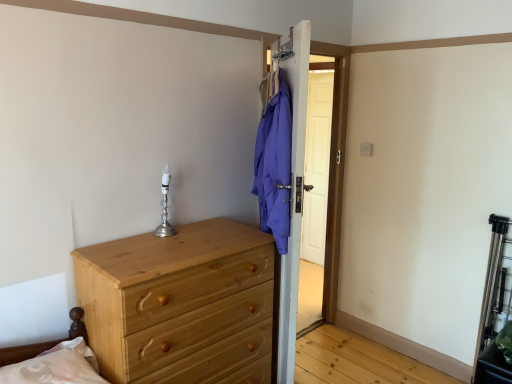
Measure the distance between natural wood chest of drawers at lower left and camera.

natural wood chest of drawers at lower left and camera are 4.91 feet apart.

Where is `silver metallic candle holder at center`? Image resolution: width=512 pixels, height=384 pixels. silver metallic candle holder at center is located at coordinates (165, 208).

Is the depth of silver metallic candle holder at center greater than that of natural wood chest of drawers at lower left?

Yes, the depth of silver metallic candle holder at center is greater than that of natural wood chest of drawers at lower left.

Based on the photo, is silver metallic candle holder at center inside the boundaries of natural wood chest of drawers at lower left, or outside?

silver metallic candle holder at center is not enclosed by natural wood chest of drawers at lower left.

Could you measure the distance between silver metallic candle holder at center and natural wood chest of drawers at lower left?

A distance of 18.42 inches exists between silver metallic candle holder at center and natural wood chest of drawers at lower left.

From a real-world perspective, is silver metallic candle holder at center over natural wood chest of drawers at lower left?

Yes, from a real-world perspective, silver metallic candle holder at center is over natural wood chest of drawers at lower left

Is point (183, 353) closer to viewer compared to point (91, 358)?

No, (183, 353) is behind (91, 358).

Can we say natural wood chest of drawers at lower left lies outside brown wooden bed frame at lower left?

Indeed, natural wood chest of drawers at lower left is completely outside brown wooden bed frame at lower left.

Relative to brown wooden bed frame at lower left, is natural wood chest of drawers at lower left in front or behind?

Clearly, natural wood chest of drawers at lower left is behind brown wooden bed frame at lower left.

In the scene shown: Is natural wood chest of drawers at lower left shorter than brown wooden bed frame at lower left?

No.

Is natural wood chest of drawers at lower left positioned with its back to silver metallic candle holder at center?

That's not correct — natural wood chest of drawers at lower left is not looking away from silver metallic candle holder at center.

Is natural wood chest of drawers at lower left wider or thinner than silver metallic candle holder at center?

natural wood chest of drawers at lower left is wider than silver metallic candle holder at center.

Considering the relative sizes of natural wood chest of drawers at lower left and silver metallic candle holder at center in the image provided, is natural wood chest of drawers at lower left taller than silver metallic candle holder at center?

Indeed, natural wood chest of drawers at lower left has a greater height compared to silver metallic candle holder at center.

From a real-world perspective, is natural wood chest of drawers at lower left physically above silver metallic candle holder at center?

No, from a real-world perspective, natural wood chest of drawers at lower left is not over silver metallic candle holder at center

Is natural wood chest of drawers at lower left inside brown wooden bed frame at lower left?

No, natural wood chest of drawers at lower left is not surrounded by brown wooden bed frame at lower left.

Which object is wider, brown wooden bed frame at lower left or natural wood chest of drawers at lower left?

With larger width is natural wood chest of drawers at lower left.

In the scene shown: Is brown wooden bed frame at lower left to the left or to the right of natural wood chest of drawers at lower left in the image?

brown wooden bed frame at lower left is positioned on natural wood chest of drawers at lower left's left side.

Is silver metallic candle holder at center turned away from brown wooden bed frame at lower left?

No, silver metallic candle holder at center's orientation is not away from brown wooden bed frame at lower left.

Is silver metallic candle holder at center to the left of brown wooden bed frame at lower left from the viewer's perspective?

No, silver metallic candle holder at center is not to the left of brown wooden bed frame at lower left.

Is the depth of silver metallic candle holder at center less than that of brown wooden bed frame at lower left?

No, it is behind brown wooden bed frame at lower left.

Would you consider brown wooden bed frame at lower left to be distant from silver metallic candle holder at center?

No, there isn't a large distance between brown wooden bed frame at lower left and silver metallic candle holder at center.

Consider the image. Considering the sizes of objects brown wooden bed frame at lower left and silver metallic candle holder at center in the image provided, who is bigger, brown wooden bed frame at lower left or silver metallic candle holder at center?

brown wooden bed frame at lower left is bigger.

Which object is positioned more to the right, brown wooden bed frame at lower left or silver metallic candle holder at center?

Positioned to the right is silver metallic candle holder at center.

Does brown wooden bed frame at lower left have a greater width compared to silver metallic candle holder at center?

Correct, the width of brown wooden bed frame at lower left exceeds that of silver metallic candle holder at center.

What are the coordinates of `the chest of drawers that appears in front of the silver metallic candle holder at center` in the screenshot? It's located at (180, 304).

This screenshot has height=384, width=512. What are the coordinates of `the chest of drawers that appears below the brown wooden bed frame at lower left (from a real-world perspective)` in the screenshot? It's located at (180, 304).

When comparing their distances from silver metallic candle holder at center, does natural wood chest of drawers at lower left or brown wooden bed frame at lower left seem closer?

natural wood chest of drawers at lower left lies closer to silver metallic candle holder at center than the other object.

Which object lies further to the anchor point natural wood chest of drawers at lower left, silver metallic candle holder at center or brown wooden bed frame at lower left?

The object further to natural wood chest of drawers at lower left is silver metallic candle holder at center.

Which object lies nearer to the anchor point brown wooden bed frame at lower left, silver metallic candle holder at center or natural wood chest of drawers at lower left?

natural wood chest of drawers at lower left lies closer to brown wooden bed frame at lower left than the other object.

Looking at this image, based on their spatial positions, is brown wooden bed frame at lower left or natural wood chest of drawers at lower left further from silver metallic candle holder at center?

The object further to silver metallic candle holder at center is brown wooden bed frame at lower left.

Looking at the image, which one is located closer to natural wood chest of drawers at lower left, brown wooden bed frame at lower left or silver metallic candle holder at center?

Among the two, brown wooden bed frame at lower left is located nearer to natural wood chest of drawers at lower left.

Based on their spatial positions, is natural wood chest of drawers at lower left or silver metallic candle holder at center further from brown wooden bed frame at lower left?

silver metallic candle holder at center.

Where is `bed frame that lies between silver metallic candle holder at center and natural wood chest of drawers at lower left from top to bottom`? The image size is (512, 384). bed frame that lies between silver metallic candle holder at center and natural wood chest of drawers at lower left from top to bottom is located at coordinates (58, 362).